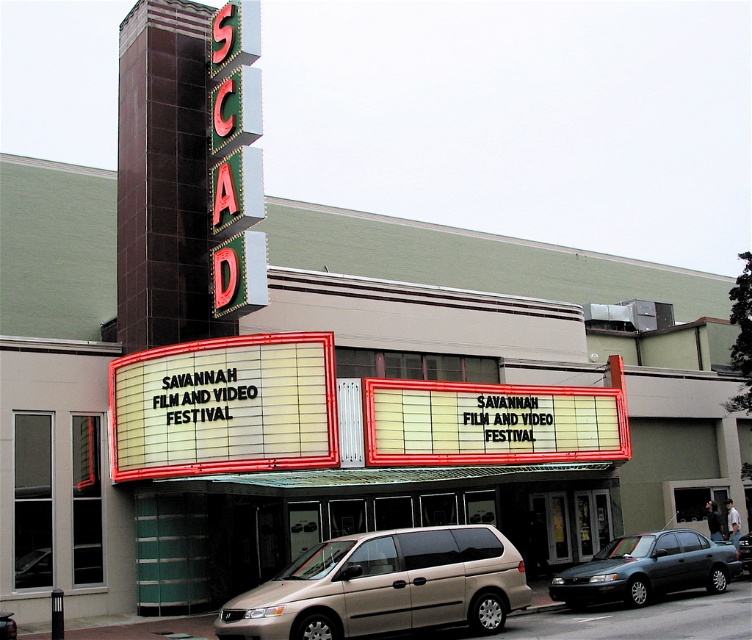
You are a pedestrian standing at the sidewalk in front of the Savannah Film and Video Festival building. You see a gold metallic minivan at lower center and a metallic green sedan at center. Which vehicle is closer to you?

The gold metallic minivan at lower center is closer to you because it is positioned in front of the metallic green sedan at center.

You are a photographer trying to capture the white marquee sign at center and the gold metallic minivan at lower center in a single frame. Based on their sizes, which object will appear larger in your photo?

The white marquee sign at center will appear larger in the photo because it is taller than the gold metallic minivan at lower center.